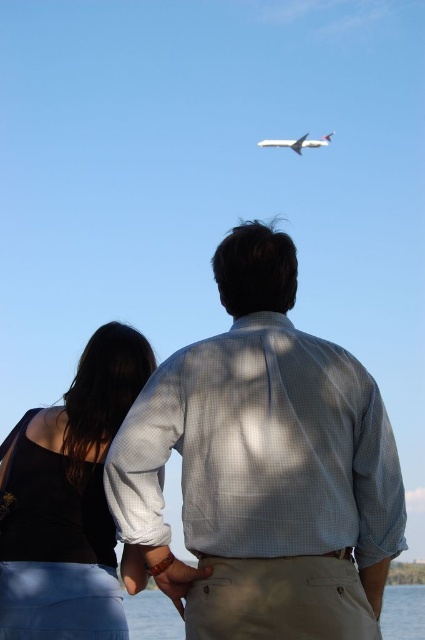
Question: Is black matte tank top at lower left above white matte airplane at upper center?

Choices:
 (A) yes
 (B) no

Answer: (B)

Question: Which object is closer to the camera taking this photo?

Choices:
 (A) black matte tank top at lower left
 (B) matte khaki pants at lower center
 (C) clear water at lower center
 (D) white checkered shirt at center

Answer: (D)

Question: Is black matte tank top at lower left to the right of matte khaki pants at lower center from the viewer's perspective?

Choices:
 (A) yes
 (B) no

Answer: (B)

Question: Which point is farther to the camera?

Choices:
 (A) (166, 579)
 (B) (302, 140)
 (C) (393, 531)

Answer: (B)

Question: Which is nearer to the matte khaki pants at lower center?

Choices:
 (A) white matte airplane at upper center
 (B) clear water at lower center

Answer: (B)

Question: Can you confirm if black matte tank top at lower left is smaller than clear water at lower center?

Choices:
 (A) yes
 (B) no

Answer: (A)